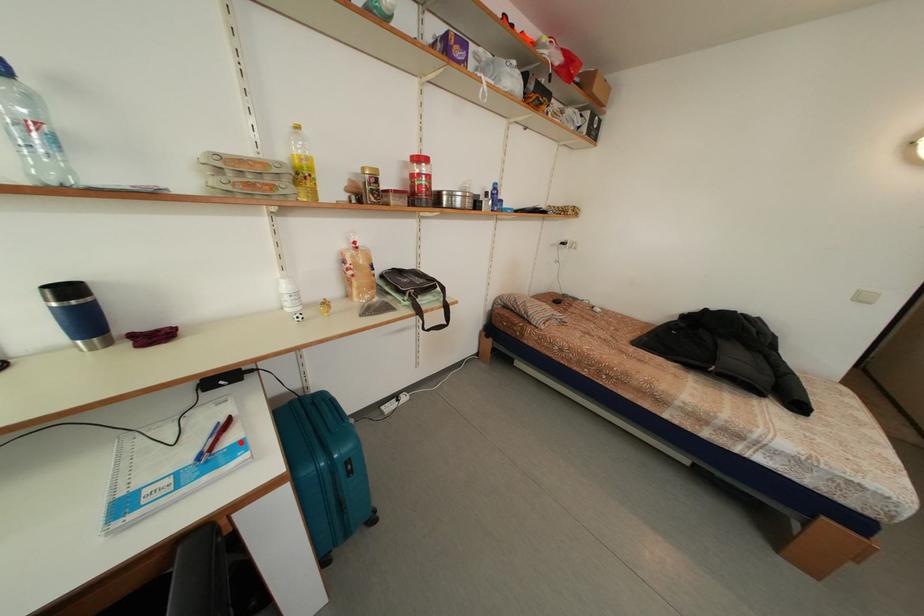
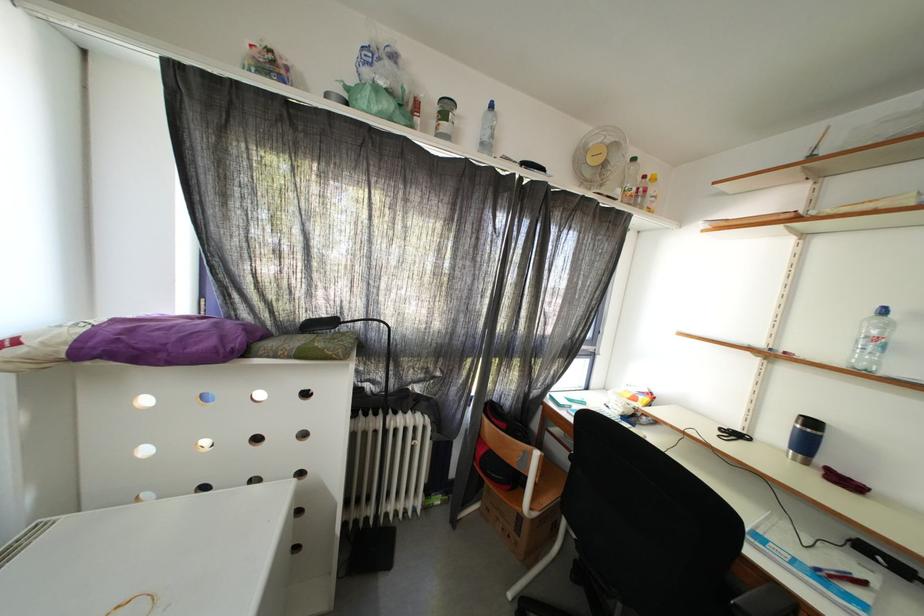
In the second image, find the point that corresponds to the highlighted location in the first image.

(864, 597)